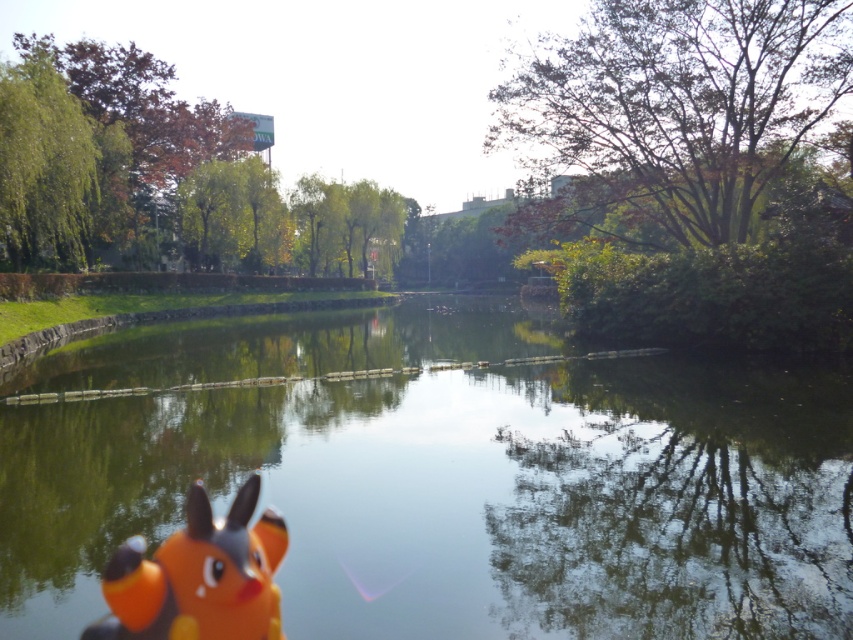
Can you confirm if green glossy water at center is bigger than orange matte pikachu at lower left?

Yes.

Measure the distance between green glossy water at center and camera.

8.28 feet

What are the coordinates of `green glossy water at center` in the screenshot? It's located at (467, 499).

Can you confirm if green leafy tree at upper right is shorter than orange matte pikachu at lower left?

No.

Which is more to the left, green leafy tree at upper right or orange matte pikachu at lower left?

From the viewer's perspective, orange matte pikachu at lower left appears more on the left side.

Describe the element at coordinates (675, 109) in the screenshot. I see `green leafy tree at upper right` at that location.

Where is `green leafy tree at upper right`? green leafy tree at upper right is located at coordinates (675, 109).

Between green glossy water at center and green leafy tree at upper right, which one is positioned higher?

green leafy tree at upper right is above.

Based on the photo, is green glossy water at center below green leafy tree at upper right?

Yes, green glossy water at center is below green leafy tree at upper right.

Where is `green glossy water at center`? The height and width of the screenshot is (640, 853). green glossy water at center is located at coordinates (467, 499).